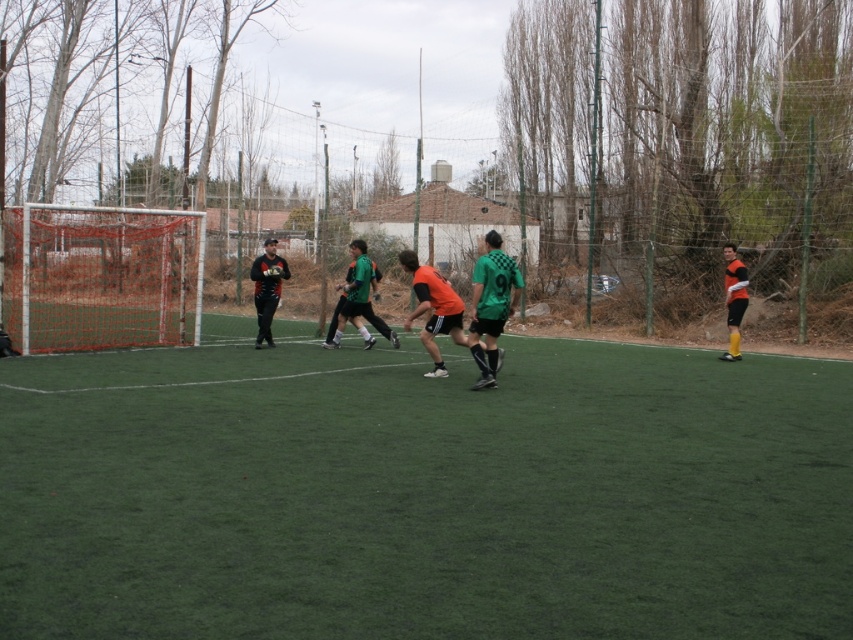
Does orange mesh net at left have a lesser width compared to green matte jersey at center?

In fact, orange mesh net at left might be wider than green matte jersey at center.

Does orange mesh net at left lie behind green matte jersey at center?

Yes, orange mesh net at left is further from the viewer.

Does point (155, 244) lie behind point (498, 272)?

Yes, it is.

Where is `orange mesh net at left`? orange mesh net at left is located at coordinates (102, 276).

This screenshot has width=853, height=640. I want to click on green artificial turf at center, so click(424, 493).

What do you see at coordinates (424, 493) in the screenshot?
I see `green artificial turf at center` at bounding box center [424, 493].

This screenshot has height=640, width=853. I want to click on green artificial turf at center, so click(424, 493).

What are the coordinates of `green artificial turf at center` in the screenshot? It's located at (424, 493).

Is orange mesh net at left smaller than orange matte jersey at right?

Actually, orange mesh net at left might be larger than orange matte jersey at right.

Which is in front, point (154, 269) or point (735, 264)?

Point (735, 264) is more forward.

Where is `orange mesh net at left`? This screenshot has width=853, height=640. orange mesh net at left is located at coordinates (102, 276).